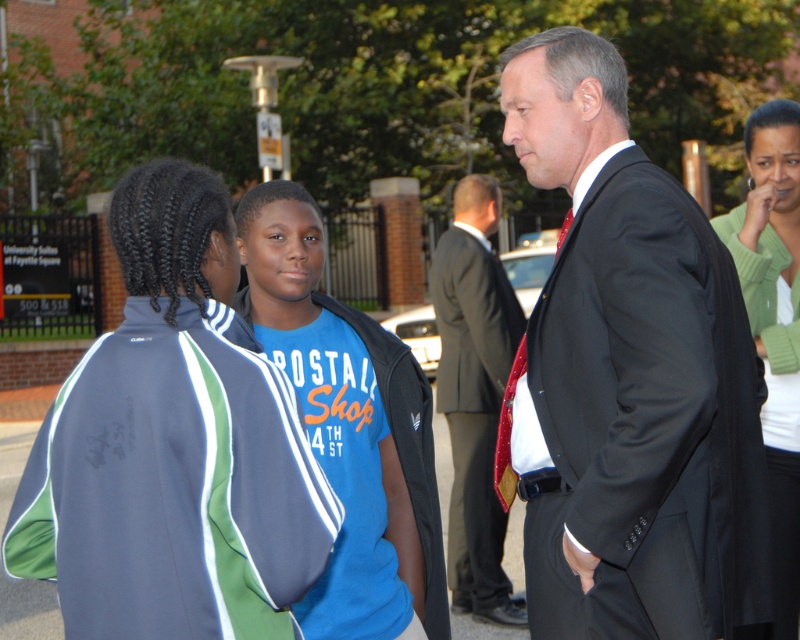
You are standing in the outdoor scene near the brick building. You see two points marked in the image. The first point is at coordinates point (280,522) and the second is at point (410,472). Which point is closer to you?

Point (280,522) is closer to the viewer than point (410,472).

You are trying to decide which clothing item to take for a quick walk. The blue fleece jacket at center is smaller than the blue cotton shirt at center. Which one would be more comfortable if you prefer a looser fit?

The blue cotton shirt at center is larger in size compared to the blue fleece jacket at center, so it would provide a looser fit and be more comfortable for a walk.